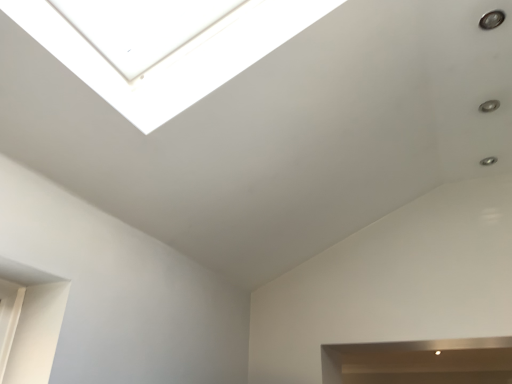
Question: Should I look upward or downward to see transparent glass window at upper center?

Choices:
 (A) up
 (B) down

Answer: (A)